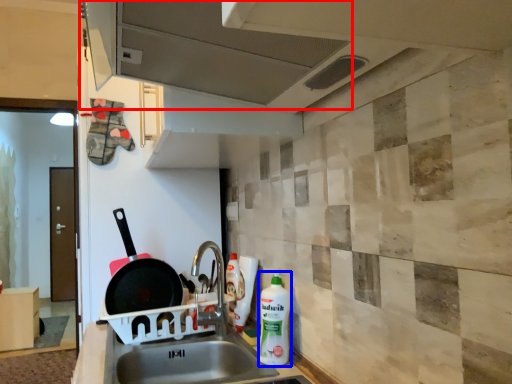
Question: Among these objects, which one is farthest to the camera, exhaust hood (highlighted by a red box) or cleaning product (highlighted by a blue box)?

Choices:
 (A) exhaust hood
 (B) cleaning product

Answer: (B)